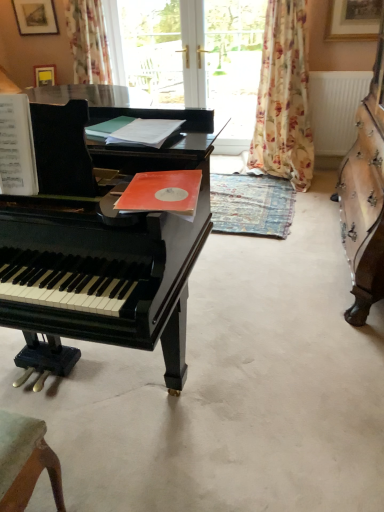
Identify the location of free spot to the right of glossy black piano at left. tap(293, 306).